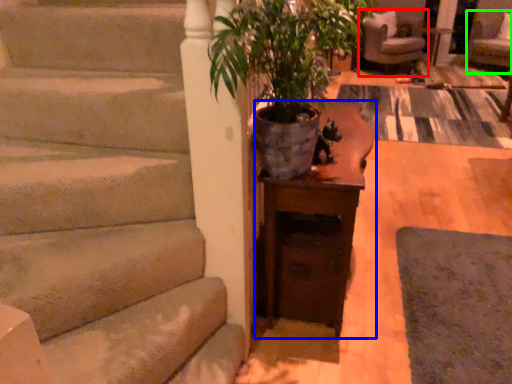
Question: Estimate the real-world distances between objects in this image. Which object is closer to chair (highlighted by a red box), table (highlighted by a blue box) or armchair (highlighted by a green box)?

Choices:
 (A) table
 (B) armchair

Answer: (B)